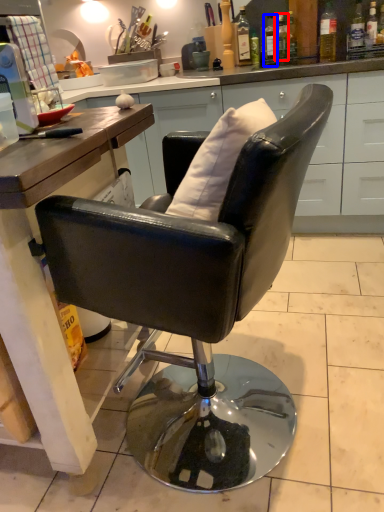
Question: Among these objects, which one is nearest to the camera, bottle (highlighted by a red box) or bottle (highlighted by a blue box)?

Choices:
 (A) bottle
 (B) bottle

Answer: (A)